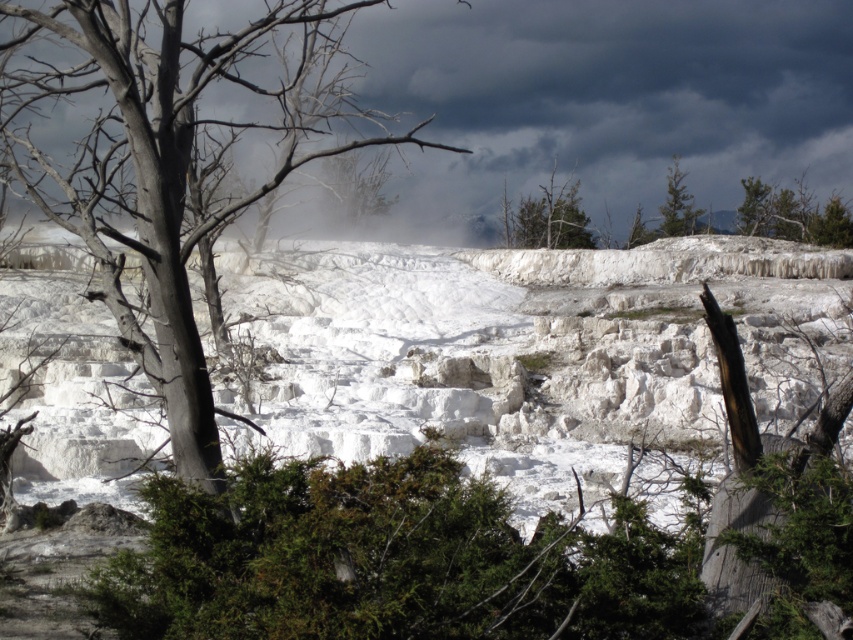
You are planning to plant a new tree that requires a minimum of 10 feet of space between it and other trees. Given the distance between the green leafy tree at upper center and the green textured pine tree at upper right, can you safely plant the new tree between them without violating the spacing requirement?

The green leafy tree at upper center is 11.15 feet from the green textured pine tree at upper right, which is more than the required 10 feet. Therefore, you can safely plant the new tree between them without violating the spacing requirement.

You are standing at the viewpoint overlooking the white terraces and notice two points marked on the landscape. The first point is at coordinates point (537, 225) and the second is at point (668, 182). Which point is closer to your current position?

Point (537, 225) is closer to the viewer than point (668, 182).

You are standing at the viewpoint overlooking the white terraces and notice the gray bark tree at left. If you want to reach the tree without moving past the terraces, is it possible?

The gray bark tree at left is 27.33 feet away from viewer, so yes, you can reach it without moving past the terraces as it is within a reasonable distance.